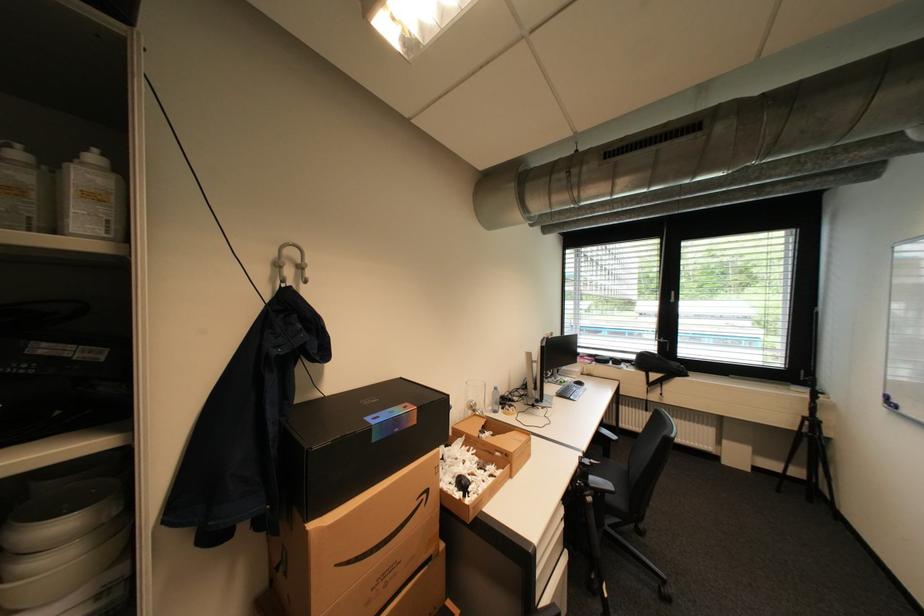
The location [488,459] corresponds to which object?

It refers to a cardboard box.